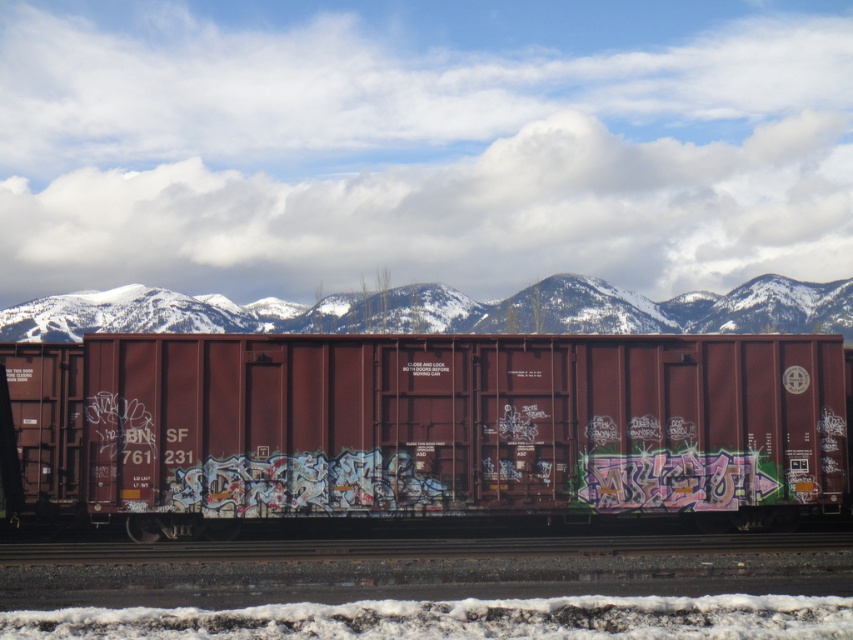
Question: Which object is farther from the camera taking this photo?

Choices:
 (A) maroon matte freight car at center
 (B) snowy mountains at upper center

Answer: (B)

Question: Does maroon matte freight car at center come behind snowy mountains at upper center?

Choices:
 (A) yes
 (B) no

Answer: (B)

Question: Does maroon matte freight car at center appear under snowy mountains at upper center?

Choices:
 (A) yes
 (B) no

Answer: (A)

Question: Is maroon matte freight car at center thinner than snowy mountains at upper center?

Choices:
 (A) yes
 (B) no

Answer: (A)

Question: Which object is closer to the camera taking this photo?

Choices:
 (A) maroon matte freight car at center
 (B) snowy mountains at upper center

Answer: (A)